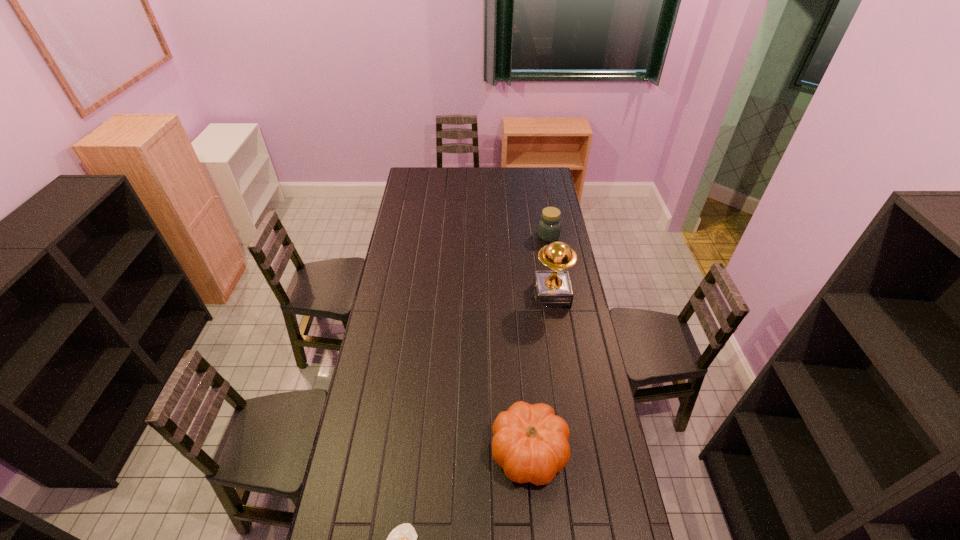
Where is `free space between the farthest object and the second tallest object`? Image resolution: width=960 pixels, height=540 pixels. free space between the farthest object and the second tallest object is located at coordinates (539, 344).

Locate an element on the screen. The image size is (960, 540). empty space between the third nearest object and the third shortest object is located at coordinates (540, 374).

This screenshot has height=540, width=960. I want to click on object that is the closest to the tallest object, so click(x=549, y=226).

Identify which object is the nearest to the farthest object. Please provide its 2D coordinates. Your answer should be formatted as a tuple, i.e. [(x, y)], where the tuple contains the x and y coordinates of a point satisfying the conditions above.

[(552, 289)]

This screenshot has width=960, height=540. In order to click on free space that satisfies the following two spatial constraints: 1. on the front side of the jar; 2. on the front-facing side of the award in this screenshot , I will do `click(559, 295)`.